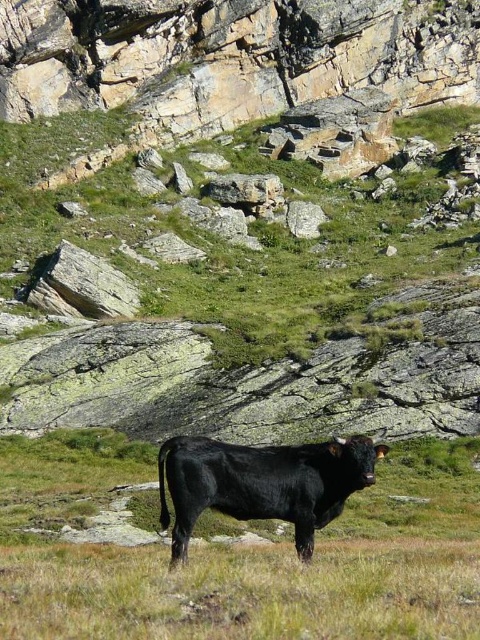
Is point (11, 576) behind point (300, 486)?

Yes, it is.

Who is positioned more to the left, black smooth cow at center or black smooth bull at center?

black smooth cow at center is more to the left.

This screenshot has width=480, height=640. In order to click on black smooth cow at center in this screenshot , I will do `click(242, 589)`.